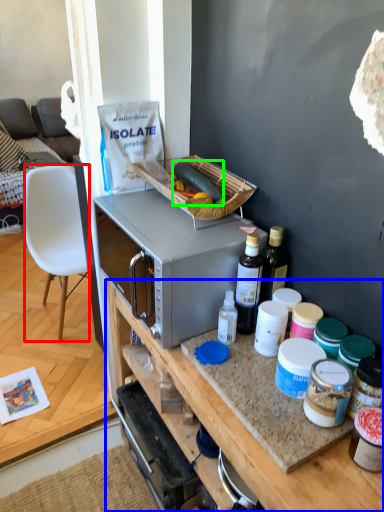
Question: Which object is positioned farthest from chair (highlighted by a red box)? Select from desk (highlighted by a blue box) and food (highlighted by a green box).

Choices:
 (A) desk
 (B) food

Answer: (A)